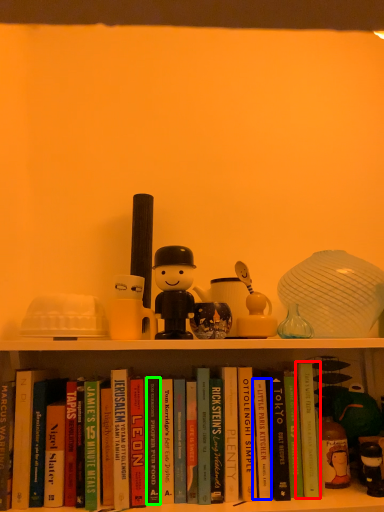
Question: Which is nearer to the paperback book (highlighted by a red box)? paperback book (highlighted by a blue box) or paperback book (highlighted by a green box).

Choices:
 (A) paperback book
 (B) paperback book

Answer: (A)